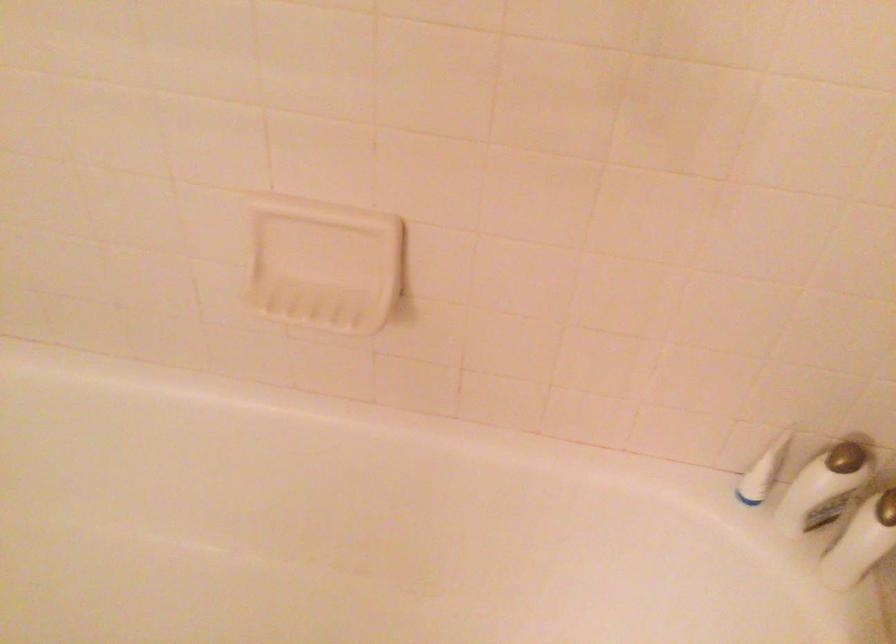
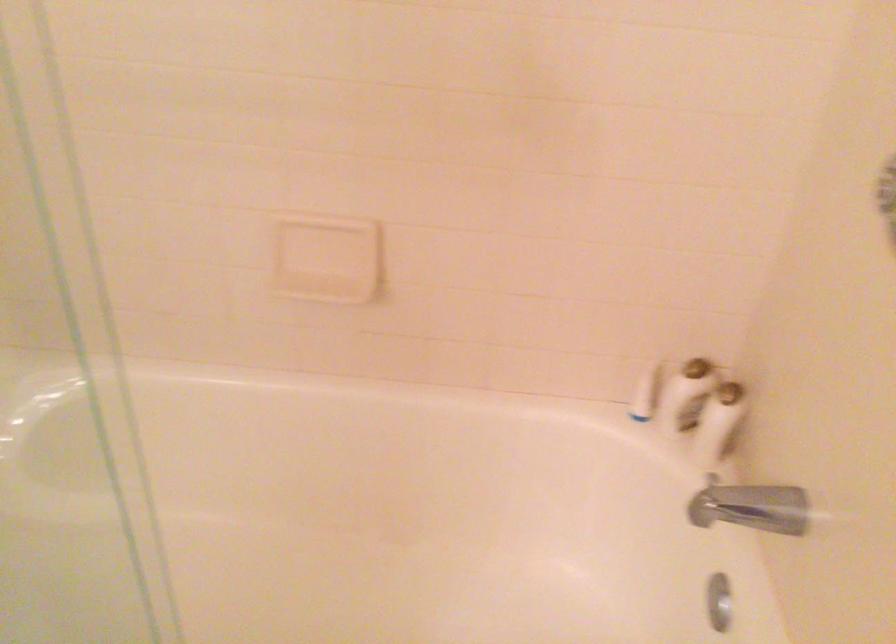
Find the pixel in the second image that matches pixel 760 478 in the first image.

(644, 393)